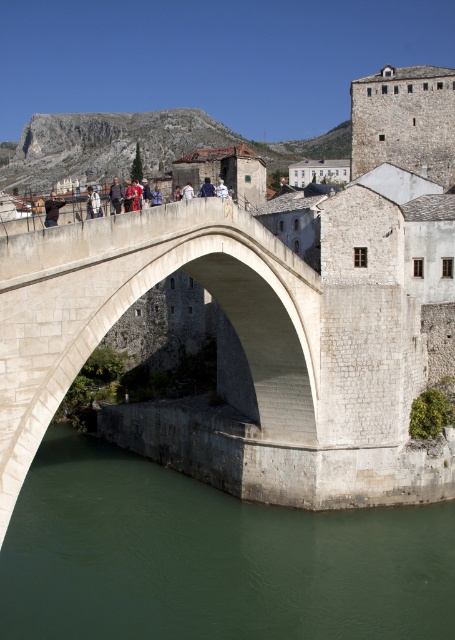
You are standing on the historic stone bridge and see a person wearing a dark brown leather jacket at center and a blue fabric shirt at center. Which clothing item is positioned higher on the person?

The dark brown leather jacket at center is above the blue fabric shirt at center, so the dark brown leather jacket at center is positioned higher on the person.

You are a photographer planning to take a portrait of a person standing on the historic stone bridge. You notice the person is wearing dark blue jeans at center and a blue fabric shirt at center. Which piece of clothing will occupy more space in your photo?

The dark blue jeans at center is larger in size than the blue fabric shirt at center, so it will occupy more space in the photo.

You are a tourist standing on the historic stone bridge and want to take a photo of the green stone water at lower center. Where should you aim your camera to capture it?

You should aim your camera at point (x=210, y=557) to capture the green stone water at lower center.